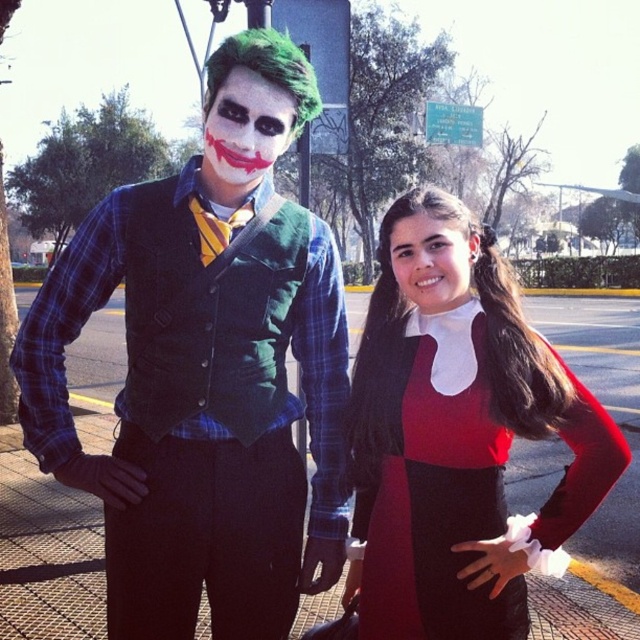
You are a photographer setting up for a photo shoot. You need to position the two subjects so that the distance between the matte black vest at center and the matte red sweater at center is exactly 20 inches. Currently, they are standing too close. How much more space should you ask them to create between the two items?

The current distance between the matte black vest at center and the matte red sweater at center is 17.80 inches. To reach the desired 20 inches, they need to increase the distance by 2.20 inches.

You are taking a photo of the two costumed characters. The Joker is at point (301, 355) and Harley Quinn is at point (358, 538). If you want to focus on the character closer to the camera, which point should you focus on?

The point closer to the camera is point (301, 355), which corresponds to The Joker. Therefore, focus on point (301, 355) to capture the Joker clearly.

You are a costume designer observing the two characters in the image. Both the matte red sweater at center and the matte red dress at center are part of their costumes. Which of these two items has a taller appearance?

The matte red sweater at center has a greater height compared to the matte red dress at center, so the sweater appears taller.